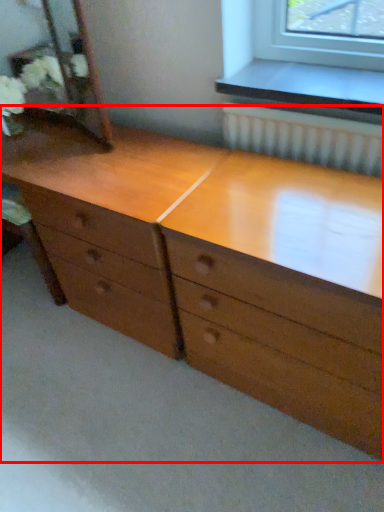
Question: Observing the image, what is the correct spatial positioning of chest of drawers (annotated by the red box) in reference to mirror?

Choices:
 (A) left
 (B) right

Answer: (B)